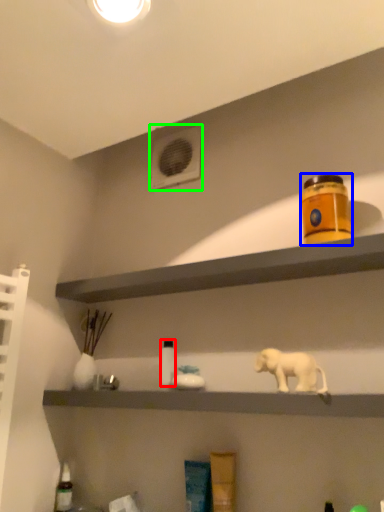
Question: Considering the real-world distances, which object is closest to bottle (highlighted by a red box)? product (highlighted by a blue box) or air conditioning (highlighted by a green box).

Choices:
 (A) product
 (B) air conditioning

Answer: (A)